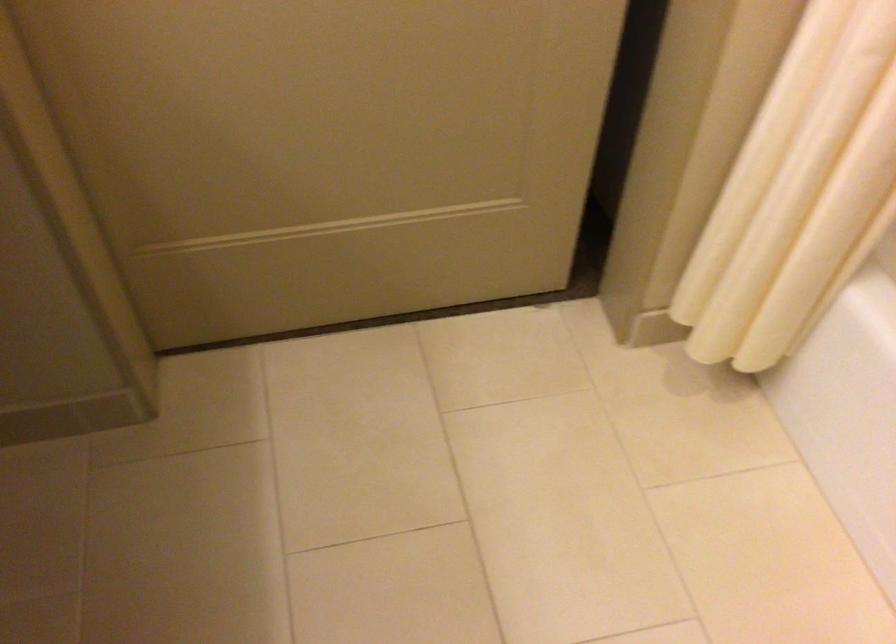
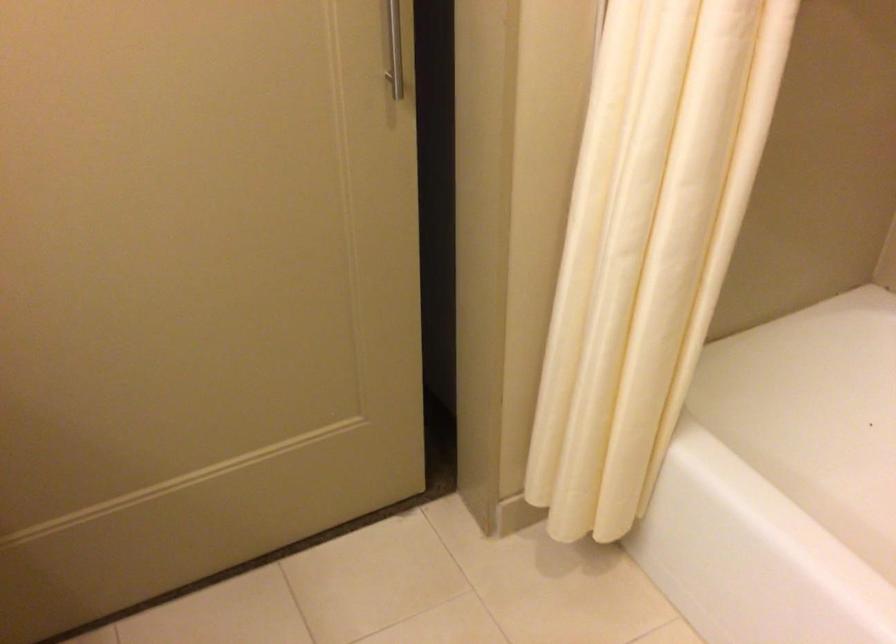
Question: Based on the continuous images, in which direction is the camera rotating? Reply with the corresponding letter.

Choices:
 (A) Left
 (B) Right
 (C) Up
 (D) Down

Answer: (C)